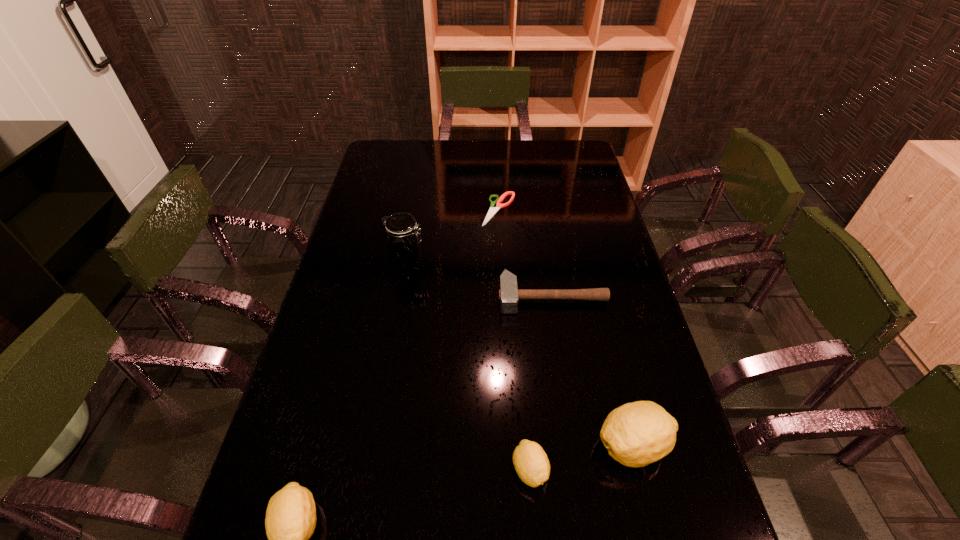
The width and height of the screenshot is (960, 540). Identify the location of vacant region located at the stem end of the tallest lemon. (451, 446).

Locate an element on the screen. The width and height of the screenshot is (960, 540). free spot located at the stem end of the tallest lemon is located at coordinates (505, 446).

This screenshot has height=540, width=960. In order to click on free point located 0.050m at the stem end of the tallest lemon in this screenshot , I will do `click(571, 446)`.

Locate an element on the screen. This screenshot has height=540, width=960. vacant space located on the front of the shortest object is located at coordinates (504, 299).

At what (x,y) coordinates should I click in order to perform the action: click on free spot located 0.280m on the lid of the jar. Please return your answer as a coordinate pair (x, y). Looking at the image, I should click on (514, 263).

This screenshot has height=540, width=960. Find the location of `vacant area situated 0.150m on the striking surface of the fifth tallest object`. vacant area situated 0.150m on the striking surface of the fifth tallest object is located at coordinates (562, 359).

This screenshot has height=540, width=960. I want to click on object situated at the near edge, so click(x=531, y=463).

Where is `lemon present at the right edge`? This screenshot has width=960, height=540. lemon present at the right edge is located at coordinates (636, 434).

Where is `hammer that is at the right edge`? hammer that is at the right edge is located at coordinates (509, 294).

Identify the location of vacant point at the far edge. (482, 147).